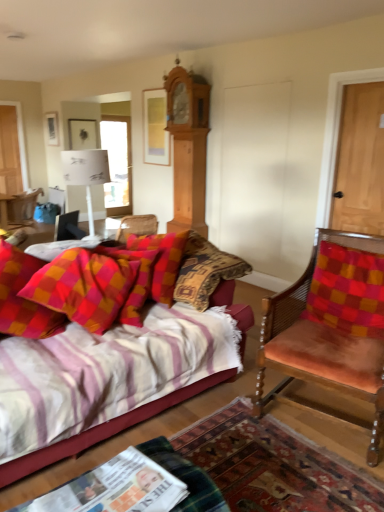
Question: From the image's perspective, would you say striped fabric couch at lower left is positioned over velvet pink chair at left, the 2th chair positioned from the front?

Choices:
 (A) yes
 (B) no

Answer: (B)

Question: Does striped fabric couch at lower left have a smaller size compared to velvet pink chair at left, the second chair positioned from the bottom?

Choices:
 (A) no
 (B) yes

Answer: (A)

Question: Can you confirm if striped fabric couch at lower left is positioned to the left of velvet pink chair at left, the 2th chair when ordered from right to left?

Choices:
 (A) yes
 (B) no

Answer: (B)

Question: Considering the relative sizes of striped fabric couch at lower left and velvet pink chair at left, positioned as the first chair in left-to-right order, in the image provided, is striped fabric couch at lower left bigger than velvet pink chair at left, positioned as the first chair in left-to-right order,?

Choices:
 (A) no
 (B) yes

Answer: (B)

Question: Can you confirm if striped fabric couch at lower left is wider than velvet pink chair at left, the second chair positioned from the bottom?

Choices:
 (A) yes
 (B) no

Answer: (A)

Question: Is striped fabric couch at lower left oriented towards velvet pink chair at left, the first chair positioned from the back?

Choices:
 (A) no
 (B) yes

Answer: (A)

Question: Is black plastic phone at lower left touching plush cotton pillow at center-left, the second pillow viewed from the right?

Choices:
 (A) no
 (B) yes

Answer: (A)

Question: Does black plastic phone at lower left have a greater height compared to plush cotton pillow at center-left, the first pillow viewed from the left?

Choices:
 (A) yes
 (B) no

Answer: (B)

Question: Could you tell me if black plastic phone at lower left is facing plush cotton pillow at center-left, the second pillow viewed from the right?

Choices:
 (A) yes
 (B) no

Answer: (B)

Question: Would you say black plastic phone at lower left is outside plush cotton pillow at center-left, the second pillow viewed from the right?

Choices:
 (A) no
 (B) yes

Answer: (B)

Question: Can you confirm if black plastic phone at lower left is positioned to the right of plush cotton pillow at center-left, the first pillow viewed from the left?

Choices:
 (A) yes
 (B) no

Answer: (B)

Question: From a real-world perspective, is black plastic phone at lower left physically above plush cotton pillow at center-left, the first pillow viewed from the left?

Choices:
 (A) no
 (B) yes

Answer: (B)

Question: Is striped fabric couch at lower left not within velvet orange chair at right, placed as the first chair when sorted from front to back?

Choices:
 (A) no
 (B) yes

Answer: (B)